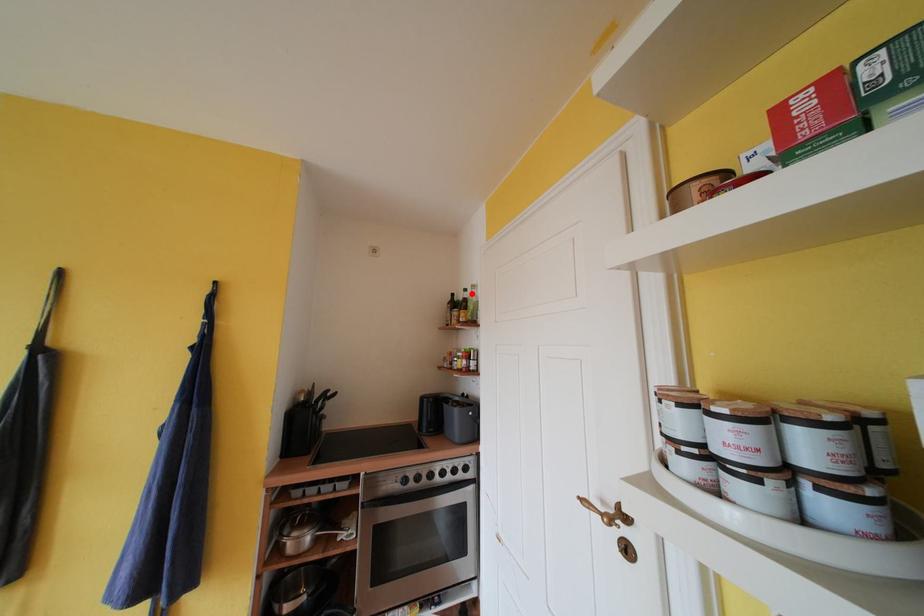
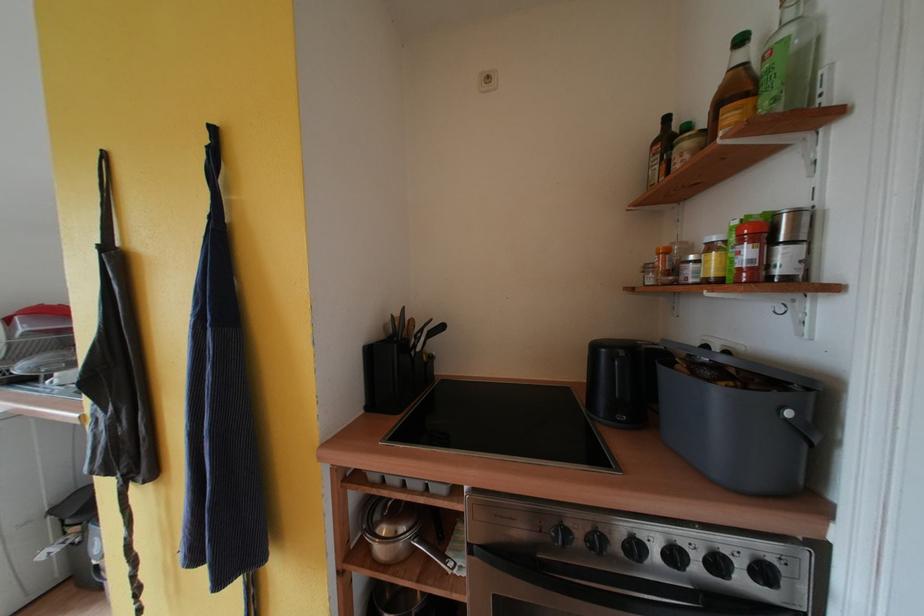
Find the pixel in the second image that matches the highlighted location in the first image.

(748, 44)